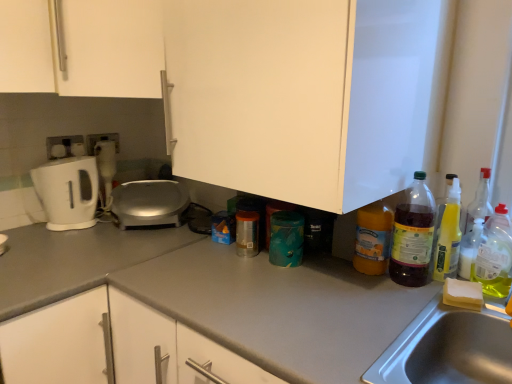
At what (x,y) coordinates should I click in order to perform the action: click on vacant region in front of satin silver appliance at center. Please return your answer as a coordinate pair (x, y). This screenshot has height=384, width=512. Looking at the image, I should click on (124, 245).